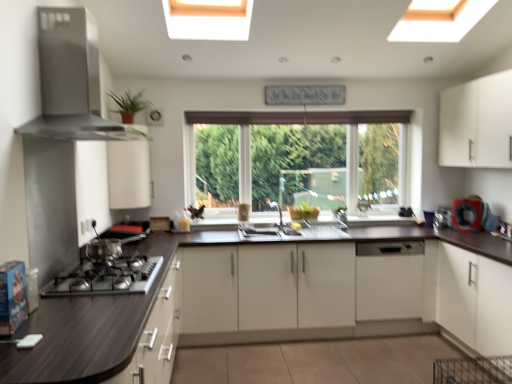
Question: Is black rubber ring at right situated inside green matte plant at upper left or outside?

Choices:
 (A) outside
 (B) inside

Answer: (A)

Question: Looking at their shapes, would you say black rubber ring at right is wider or thinner than green matte plant at upper left?

Choices:
 (A) thin
 (B) wide

Answer: (A)

Question: Considering the real-world distances, which object is closest to the dark wood countertop at lower left?

Choices:
 (A) clear glass window at center
 (B) white matte cabinet at upper right, arranged as the first cabinetry when viewed from the right
 (C) green matte plant at upper left
 (D) black rubber ring at right
 (E) stainless steel range hood at upper left

Answer: (E)

Question: Considering the real-world distances, which object is farthest from the white matte cabinet at upper right, acting as the fourth cabinetry starting from the left?

Choices:
 (A) clear glass window at center
 (B) white glossy sink at center
 (C) black rubber ring at right
 (D) white matte cabinet at upper center, the 1th cabinetry from the left
 (E) white matte cabinet at center, which is the 3th cabinetry in right-to-left order

Answer: (D)